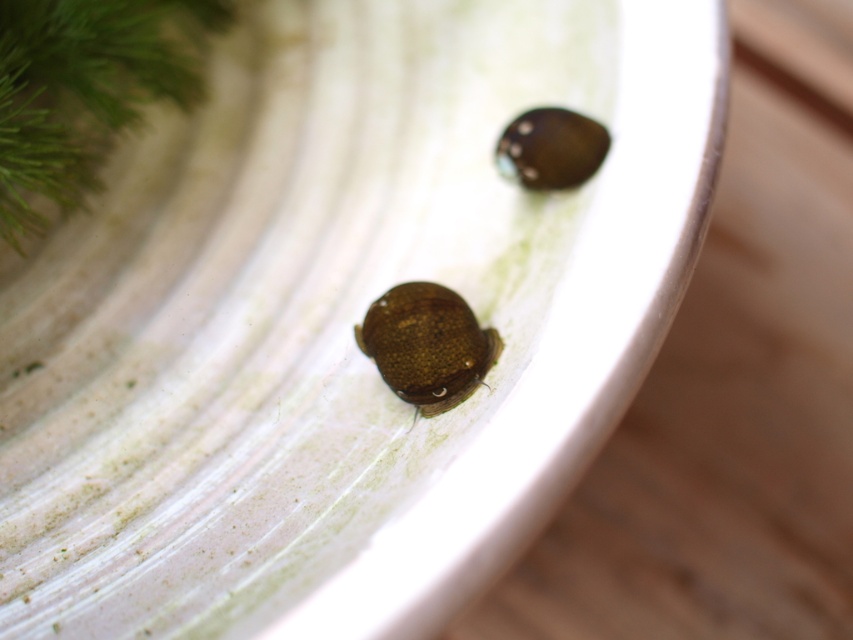
Question: Which point is farther from the camera taking this photo?

Choices:
 (A) (119, 52)
 (B) (410, 289)

Answer: (A)

Question: Does green leafy dill at upper left appear on the left side of brown matte beetle at center?

Choices:
 (A) no
 (B) yes

Answer: (B)

Question: Observing the image, what is the correct spatial positioning of green leafy dill at upper left in reference to brown matte beetle at center?

Choices:
 (A) left
 (B) right

Answer: (A)

Question: Is green leafy dill at upper left positioned before brown matte beetle at center?

Choices:
 (A) no
 (B) yes

Answer: (B)

Question: Which point appears closest to the camera in this image?

Choices:
 (A) (9, 221)
 (B) (430, 339)

Answer: (B)